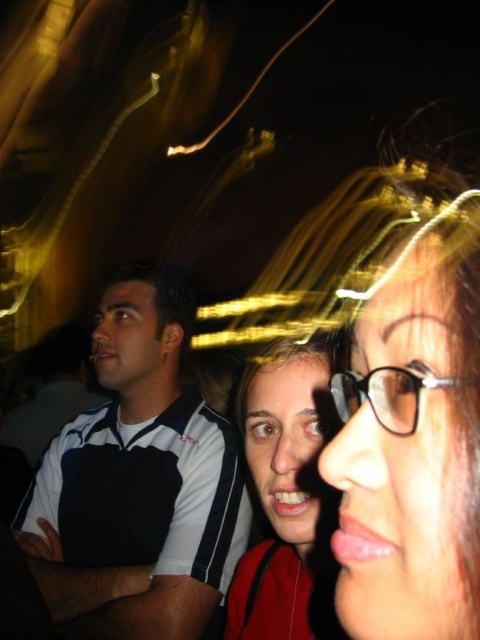
Question: Estimate the real-world distances between objects in this image. Which object is farther from the matte red backpack at center?

Choices:
 (A) white and black striped polo shirt at left
 (B) matte black glasses at center
 (C) transparent plastic glasses at center

Answer: (B)

Question: Is white and black striped polo shirt at left to the left of matte red backpack at center from the viewer's perspective?

Choices:
 (A) yes
 (B) no

Answer: (A)

Question: Is matte black glasses at center behind white and black striped polo shirt at left?

Choices:
 (A) no
 (B) yes

Answer: (A)

Question: Does matte black glasses at center come in front of matte red backpack at center?

Choices:
 (A) no
 (B) yes

Answer: (B)

Question: Which object is closer to the camera taking this photo?

Choices:
 (A) white and black striped polo shirt at left
 (B) matte red backpack at center

Answer: (B)

Question: Which point is farther to the camera?

Choices:
 (A) white and black striped polo shirt at left
 (B) matte red backpack at center
 (C) transparent plastic glasses at center
 (D) matte black glasses at center

Answer: (A)